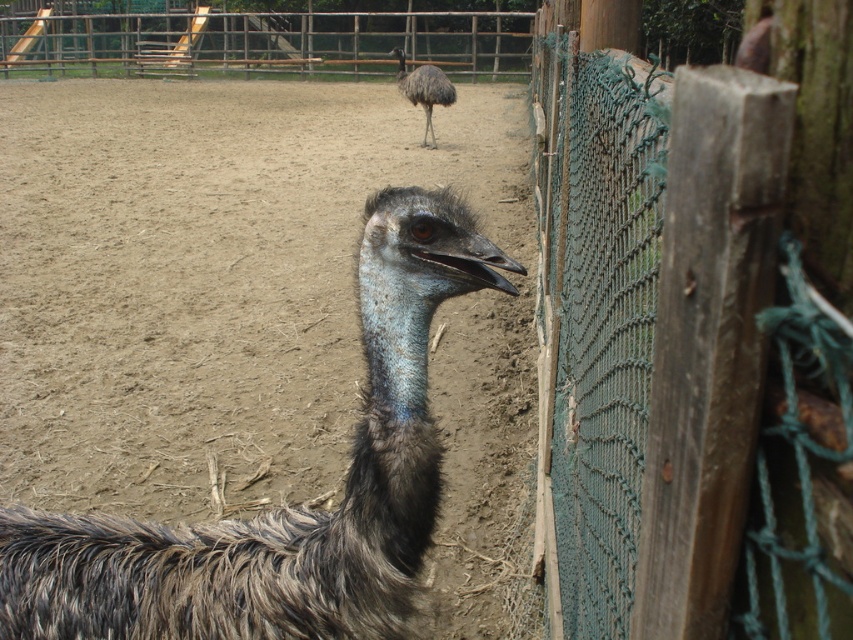
Question: Is green mesh fence at right above dark brown feathers at upper center?

Choices:
 (A) no
 (B) yes

Answer: (A)

Question: Where is green mesh fence at right located in relation to dark brown feathers at upper center in the image?

Choices:
 (A) left
 (B) right

Answer: (B)

Question: Which point is closer to the camera?

Choices:
 (A) (427, 108)
 (B) (824, 509)
 (C) (45, 589)

Answer: (B)

Question: Does dark brown feathered ostrich at center lie behind dark brown feathers at upper center?

Choices:
 (A) no
 (B) yes

Answer: (A)

Question: Based on their relative distances, which object is nearer to the dark brown feathered ostrich at center?

Choices:
 (A) dark brown feathers at upper center
 (B) green mesh fence at right

Answer: (B)

Question: Based on their relative distances, which object is nearer to the dark brown feathered ostrich at center?

Choices:
 (A) dark brown feathers at upper center
 (B) green mesh fence at right

Answer: (B)